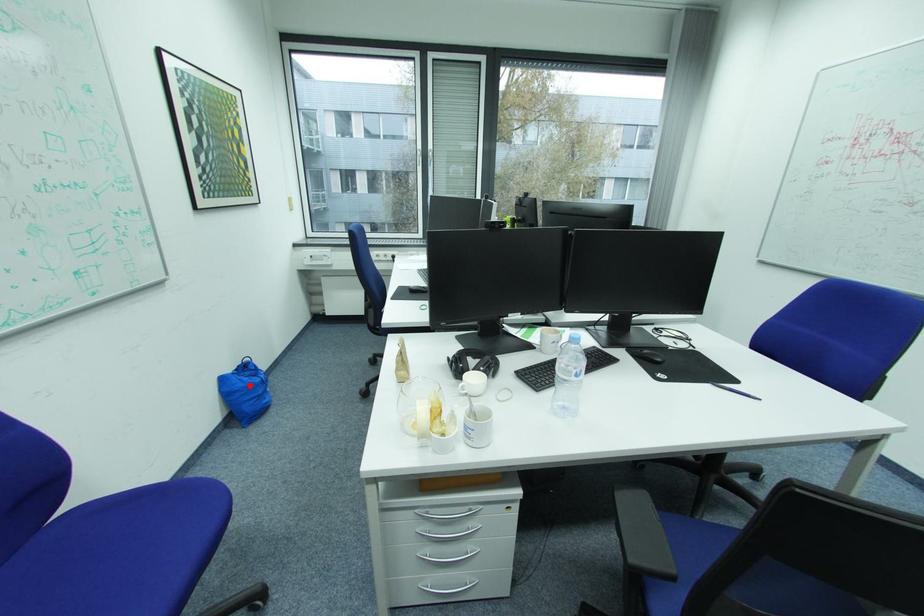
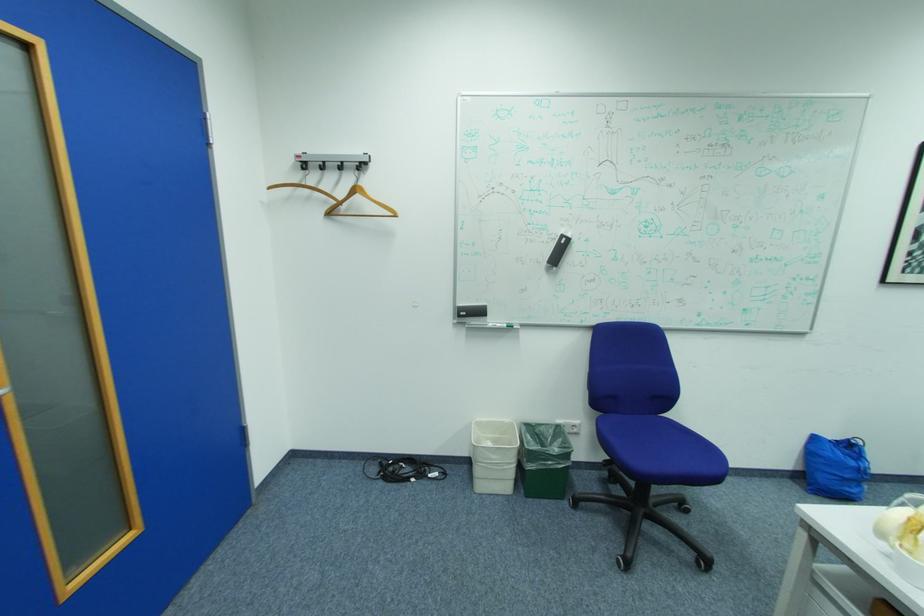
The point at the highlighted location is marked in the first image. Where is the corresponding point in the second image?

(839, 456)